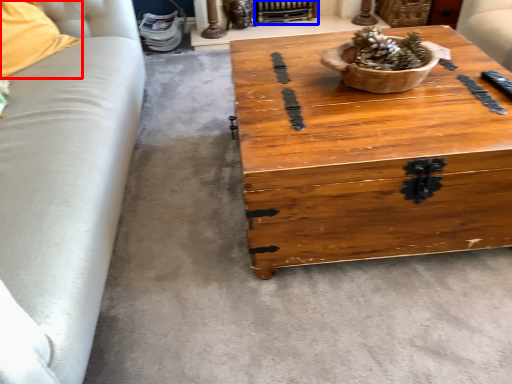
Question: Which object appears farthest to the camera in this image, pillow (highlighted by a red box) or fireplace (highlighted by a blue box)?

Choices:
 (A) pillow
 (B) fireplace

Answer: (B)